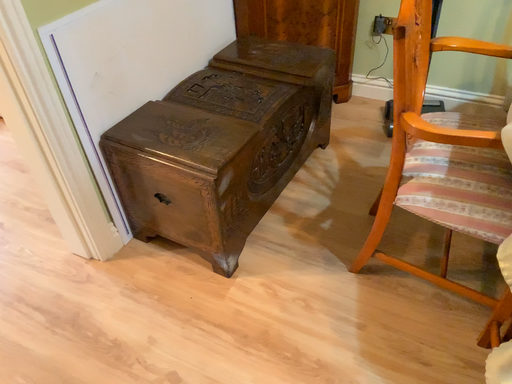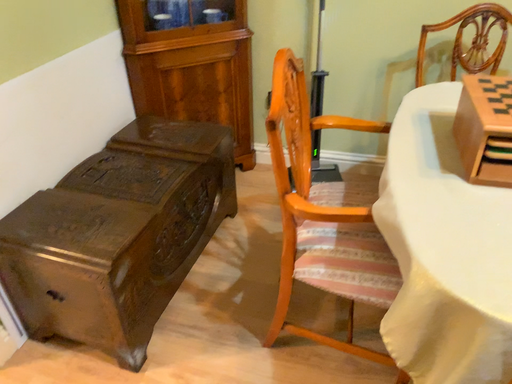
Question: How did the camera likely rotate when shooting the video?

Choices:
 (A) rotated right
 (B) rotated left

Answer: (A)